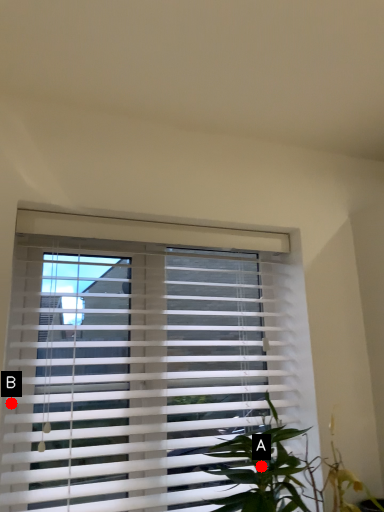
Question: Two points are circled on the image, labeled by A and B beside each circle. Which point appears farthest from the camera in this image?

Choices:
 (A) A is further
 (B) B is further

Answer: (B)